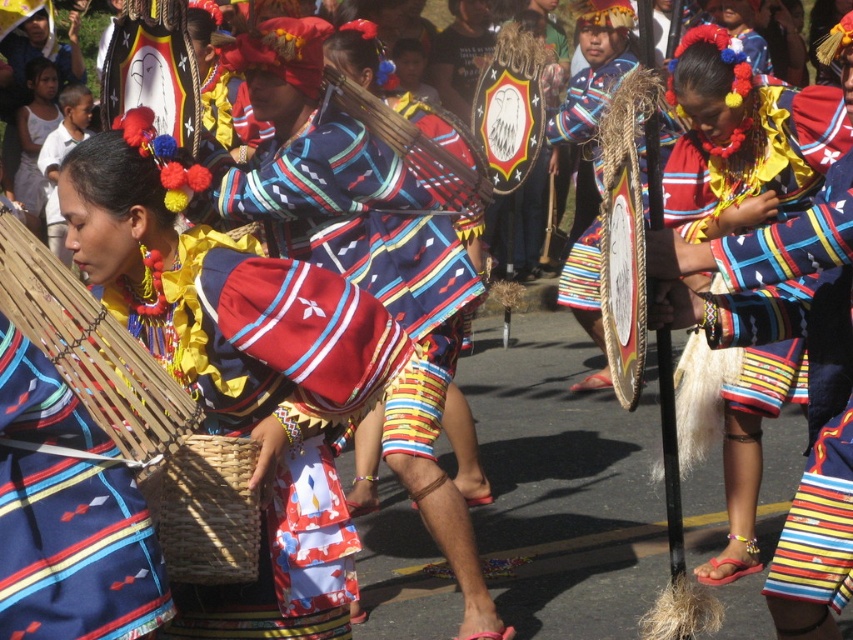
Does blue woven basket at lower left have a greater width compared to matte fabric skirt at center?

In fact, blue woven basket at lower left might be narrower than matte fabric skirt at center.

Between blue woven basket at lower left and matte fabric skirt at center, which one appears on the right side from the viewer's perspective?

Positioned to the right is matte fabric skirt at center.

Describe the element at coordinates (68, 515) in the screenshot. The height and width of the screenshot is (640, 853). I see `blue woven basket at lower left` at that location.

This screenshot has height=640, width=853. What are the coordinates of `blue woven basket at lower left` in the screenshot? It's located at (68, 515).

From the picture: Is matte fabric skirt at center to the left of matte multicolored skirt at center from the viewer's perspective?

Correct, you'll find matte fabric skirt at center to the left of matte multicolored skirt at center.

The image size is (853, 640). Describe the element at coordinates (357, 221) in the screenshot. I see `matte fabric skirt at center` at that location.

Is point (347, 156) less distant than point (683, 225)?

Yes, it is in front of point (683, 225).

Find the location of `matte fabric skirt at center`. matte fabric skirt at center is located at coordinates (357, 221).

Is point (450, 305) farther from viewer compared to point (149, 496)?

Yes, it is behind point (149, 496).

Where is `matte fabric skirt at center`? matte fabric skirt at center is located at coordinates (357, 221).

Is point (309, 220) positioned behind point (148, 490)?

Yes, it is.

In order to click on matte fabric skirt at center in this screenshot , I will do `click(357, 221)`.